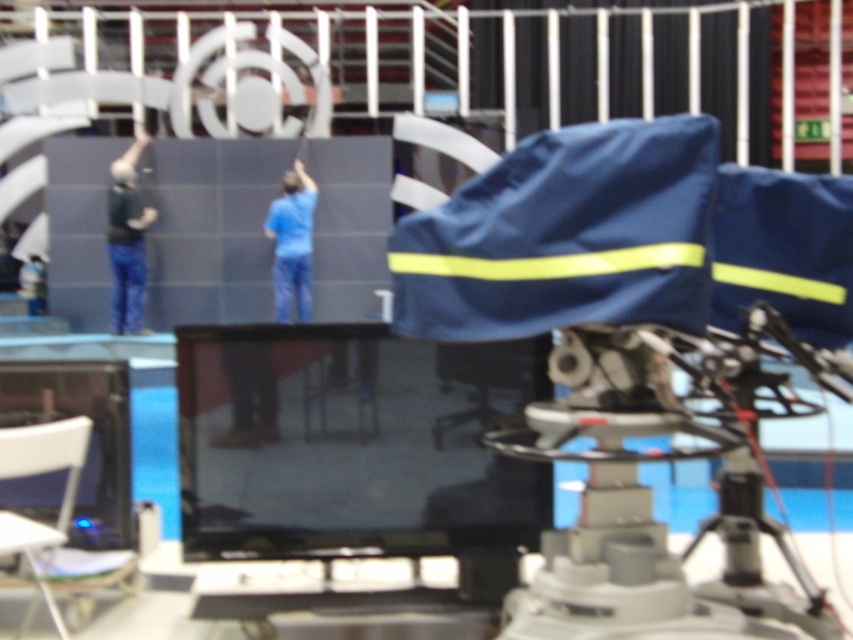
You are an event organizer checking the setup. You need to know which of the two workers has a narrower clothing item between the dark blue jeans at left and the blue matte shirt at center. Which one is it?

The dark blue jeans at left has a narrower clothing item compared to the blue matte shirt at center since its width is less than the blue matte shirt at center.

You are setting up equipment for an event and need to place a metallic tripod at center next to dark blue jeans at left. Considering their sizes, will the tripod take up more space horizontally compared to the jeans?

Yes, the metallic tripod at center has a larger width than the dark blue jeans at left, so it will take up more horizontal space.

You are a technician who needs to move the metallic tripod at center closer to the camera. How much distance do you need to cover to bring them together?

The distance between the metallic tripod at center and the camera is 5.87 feet. To bring them together, you need to cover 5.87 feet.